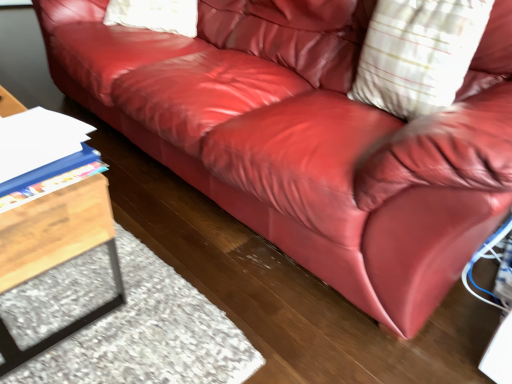
Measure the distance between white striped pillow at upper right and camera.

white striped pillow at upper right and camera are 3.58 feet apart.

The image size is (512, 384). Find the location of `white striped pillow at upper right`. white striped pillow at upper right is located at coordinates (418, 54).

In the scene shown: Between blue plastic folder at lower left and white striped pillow at upper right, which one has smaller size?

With smaller size is blue plastic folder at lower left.

In terms of width, does blue plastic folder at lower left look wider or thinner when compared to white striped pillow at upper right?

In the image, blue plastic folder at lower left appears to be wider than white striped pillow at upper right.

From a real-world perspective, which is physically below, blue plastic folder at lower left or white striped pillow at upper right?

blue plastic folder at lower left is physically lower.

Who is more distant, blue plastic folder at lower left or white striped pillow at upper right?

white striped pillow at upper right.

Which is in front, point (400, 45) or point (105, 307)?

The point (105, 307) is in front.

Is white striped pillow at upper right surrounding wooden table at left?

No, white striped pillow at upper right does not contain wooden table at left.

How different are the orientations of white striped pillow at upper right and wooden table at left in degrees?

The angular difference between white striped pillow at upper right and wooden table at left is 14.8 degrees.

Is white striped pillow at upper right oriented away from wooden table at left?

white striped pillow at upper right is not turned away from wooden table at left.

Is wooden table at left oriented away from blue plastic folder at lower left?

No, wooden table at left is not facing the opposite direction of blue plastic folder at lower left.

Is wooden table at left placed right next to blue plastic folder at lower left?

There is a gap between wooden table at left and blue plastic folder at lower left.

Is wooden table at left to the left or to the right of blue plastic folder at lower left in the image?

Based on their positions, wooden table at left is located to the left of blue plastic folder at lower left.

From the image's perspective, which one is positioned lower, wooden table at left or blue plastic folder at lower left?

wooden table at left.

Is wooden table at left further to the viewer compared to white striped pillow at upper right?

No, wooden table at left is in front of white striped pillow at upper right.

Considering the positions of point (95, 312) and point (399, 10), is point (95, 312) closer or farther from the camera than point (399, 10)?

Point (95, 312) is closer to the camera than point (399, 10).

Is wooden table at left facing towards white striped pillow at upper right?

No, wooden table at left is not turned towards white striped pillow at upper right.

From a real-world perspective, is wooden table at left beneath white striped pillow at upper right?

Yes, from a real-world perspective, wooden table at left is below white striped pillow at upper right.

Considering the sizes of white striped pillow at upper right and blue plastic folder at lower left in the image, is white striped pillow at upper right wider or thinner than blue plastic folder at lower left?

In the image, white striped pillow at upper right appears to be more narrow than blue plastic folder at lower left.

Which of these two, white striped pillow at upper right or blue plastic folder at lower left, stands taller?

Standing taller between the two is white striped pillow at upper right.

From the image's perspective, is white striped pillow at upper right located above or below blue plastic folder at lower left?

Clearly, from the image's perspective, white striped pillow at upper right is above blue plastic folder at lower left.

Is blue plastic folder at lower left inside white striped pillow at upper right?

No, blue plastic folder at lower left is not inside white striped pillow at upper right.

Can you confirm if blue plastic folder at lower left is wider than wooden table at left?

No.

Considering the sizes of objects blue plastic folder at lower left and wooden table at left in the image provided, who is bigger, blue plastic folder at lower left or wooden table at left?

wooden table at left is bigger.

Who is more distant, blue plastic folder at lower left or wooden table at left?

blue plastic folder at lower left is further from the camera.

Is blue plastic folder at lower left outside of wooden table at left?

Indeed, blue plastic folder at lower left is completely outside wooden table at left.

The image size is (512, 384). Identify the location of throw pillow lying above the blue plastic folder at lower left (from the image's perspective). (418, 54).

Locate an element on the screen. Image resolution: width=512 pixels, height=384 pixels. table that is in front of the white striped pillow at upper right is located at coordinates (55, 252).

When comparing their distances from wooden table at left, does white striped pillow at upper right or blue plastic folder at lower left seem further?

white striped pillow at upper right.

Looking at the image, which one is located further to wooden table at left, blue plastic folder at lower left or white striped pillow at upper right?

white striped pillow at upper right.

Which object lies nearer to the anchor point blue plastic folder at lower left, white striped pillow at upper right or wooden table at left?

wooden table at left.

When comparing their distances from blue plastic folder at lower left, does wooden table at left or white striped pillow at upper right seem further?

white striped pillow at upper right is further to blue plastic folder at lower left.

From the image, which object appears to be farther from white striped pillow at upper right, wooden table at left or blue plastic folder at lower left?

wooden table at left.

Based on the photo, which object lies further to the anchor point white striped pillow at upper right, blue plastic folder at lower left or wooden table at left?

The object further to white striped pillow at upper right is wooden table at left.

Identify the location of book located between wooden table at left and white striped pillow at upper right in the left-right direction. (44, 155).